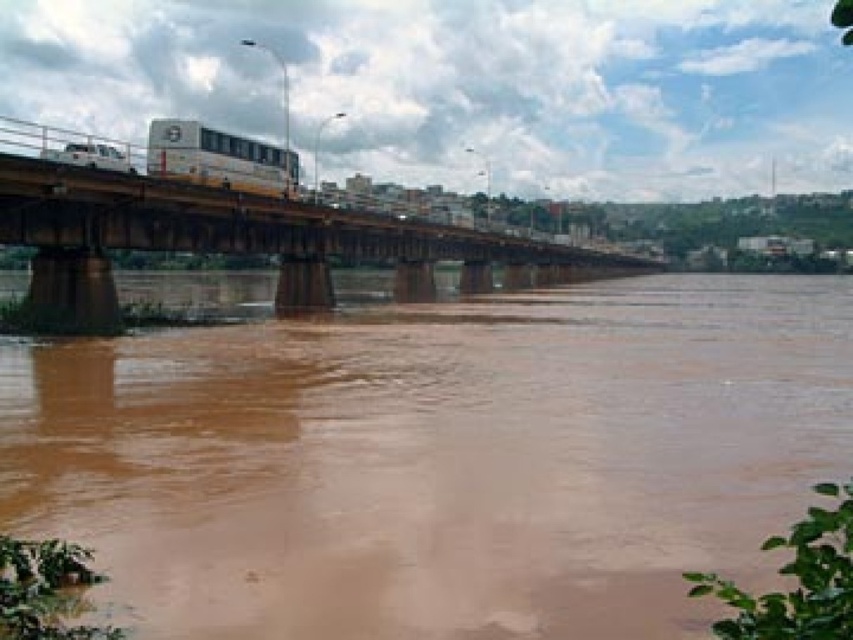
You are a driver approaching the brown metallic bridge at center. You see the yellow metallic bus at center ahead of you on the bridge. Which side of the bridge is the bus located relative to your position?

The brown metallic bridge at center is to the right of the yellow metallic bus at center, so the bus is positioned to the left of the bridge from your perspective.

In the scene shown: You are a driver approaching the bridge in the image. You notice the brown muddy water at center and the yellow metallic bus at center. Based on their positions, can you determine if the water level is currently above or below the bridge deck?

The brown muddy water at center is located below the yellow metallic bus at center, which is on the bridge deck. This indicates that the water level is below the bridge deck.

You are a driver approaching the bridge and notice the brown muddy water at center and the yellow metallic bus at center. Which object is taller from your viewpoint?

The brown muddy water at center is taller than the yellow metallic bus at center.